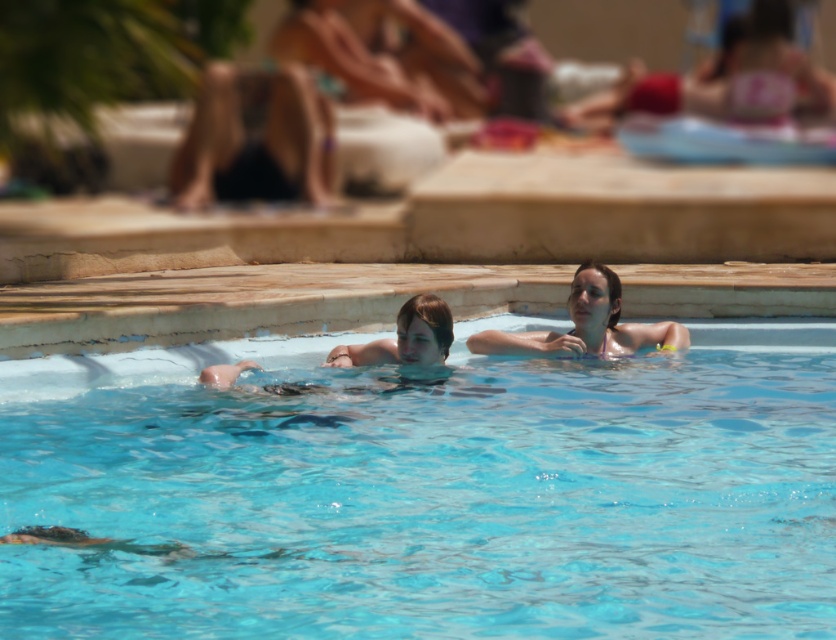
Question: Which of the following is the closest to the observer?

Choices:
 (A) (536, 388)
 (B) (597, 266)

Answer: (A)

Question: Where is transparent blue water at center located in relation to smooth skin woman at center in the image?

Choices:
 (A) below
 (B) above

Answer: (A)

Question: Which of the following is the farthest from the observer?

Choices:
 (A) transparent blue water at center
 (B) smooth skin woman at center

Answer: (B)

Question: Does transparent blue water at center appear on the right side of smooth skin woman at center?

Choices:
 (A) no
 (B) yes

Answer: (B)

Question: Does transparent blue water at center appear over smooth skin woman at center?

Choices:
 (A) no
 (B) yes

Answer: (A)

Question: Which object appears farthest from the camera in this image?

Choices:
 (A) transparent blue water at center
 (B) smooth skin woman at center

Answer: (B)